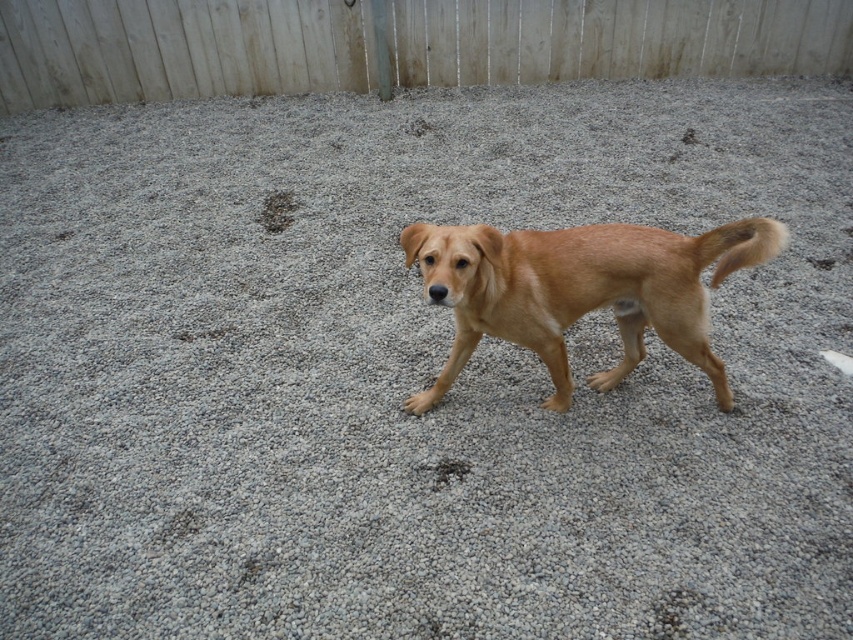
Which is in front, point (701, 12) or point (621, 237)?

Point (621, 237) is in front.

Is point (80, 13) more distant than point (466, 312)?

Yes, point (80, 13) is farther from viewer.

This screenshot has height=640, width=853. In order to click on white wooden fence at upper center in this screenshot , I will do `click(178, 49)`.